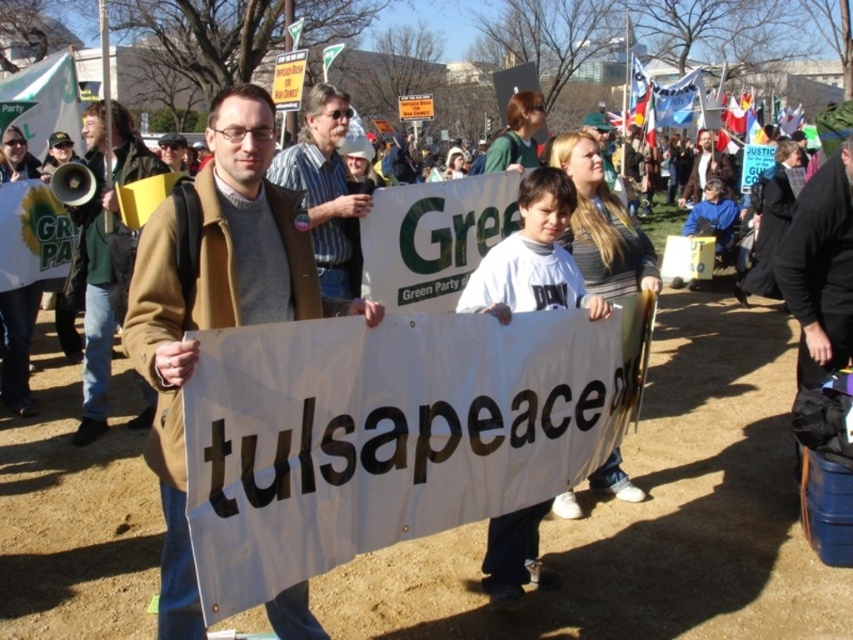
Question: Does brown wool coat at center have a lesser width compared to brown leather jacket at center?

Choices:
 (A) no
 (B) yes

Answer: (B)

Question: Which of the following is the closest to the observer?

Choices:
 (A) (78, 428)
 (B) (312, 218)
 (C) (347, 108)

Answer: (B)

Question: Among these objects, which one is farthest from the camera?

Choices:
 (A) brown wool coat at center
 (B) brown leather jacket at center
 (C) striped shirt at center
 (D) black fabric bag at right

Answer: (B)

Question: Which object is positioned farthest from the striped shirt at center?

Choices:
 (A) brown wool coat at center
 (B) black fabric bag at right

Answer: (B)

Question: Does brown leather jacket at center have a larger size compared to black fabric bag at right?

Choices:
 (A) yes
 (B) no

Answer: (A)

Question: Considering the relative positions of brown leather jacket at center and striped shirt at center in the image provided, where is brown leather jacket at center located with respect to striped shirt at center?

Choices:
 (A) right
 (B) left

Answer: (B)